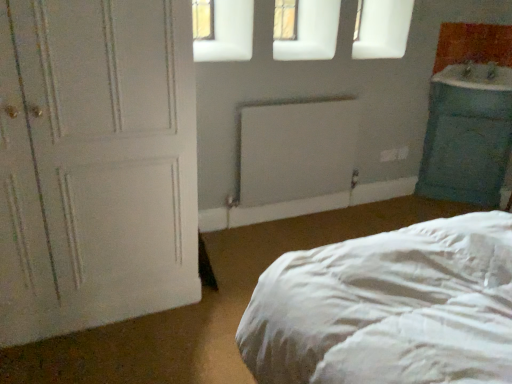
Identify the location of white matte radiator at center. This screenshot has width=512, height=384. (296, 150).

Describe the element at coordinates (466, 144) in the screenshot. This screenshot has height=384, width=512. I see `teal fabric pillow at right` at that location.

At what (x,y) coordinates should I click in order to perform the action: click on white matte radiator at center. Please return your answer as a coordinate pair (x, y). Looking at the image, I should click on (296, 150).

From the image's perspective, is teal fabric pillow at right positioned above or below white matte radiator at center?

teal fabric pillow at right is above white matte radiator at center.

Considering the sizes of objects teal fabric pillow at right and white matte radiator at center in the image provided, who is bigger, teal fabric pillow at right or white matte radiator at center?

teal fabric pillow at right is bigger.

From a real-world perspective, does teal fabric pillow at right stand above white matte radiator at center?

Yes, from a real-world perspective, teal fabric pillow at right is above white matte radiator at center.

Would you say white matte radiator at center is part of teal fabric pillow at right's contents?

Definitely not — white matte radiator at center is not inside teal fabric pillow at right.

Is white matte door at left thinner than teal fabric pillow at right?

No, white matte door at left is not thinner than teal fabric pillow at right.

In the image, is white matte door at left positioned in front of or behind teal fabric pillow at right?

Visually, white matte door at left is located in front of teal fabric pillow at right.

Which point is more forward, (68,217) or (484,189)?

The point (68,217) is closer.

Is teal fabric pillow at right at the back of white matte door at left?

No, white matte door at left is not facing away from teal fabric pillow at right.

From the image's perspective, is white matte radiator at center below white matte door at left?

No.

Is white matte radiator at center facing away from white matte door at left?

No, white matte door at left is not at the back of white matte radiator at center.

Is white matte radiator at center positioned far away from white matte door at left?

white matte radiator at center is positioned a significant distance from white matte door at left.

Can you confirm if white matte radiator at center is taller than white matte door at left?

No.

From the image's perspective, is teal fabric pillow at right positioned above or below white matte door at left?

teal fabric pillow at right is above white matte door at left.

Looking at this image, is teal fabric pillow at right oriented towards white matte door at left?

Yes, teal fabric pillow at right faces towards white matte door at left.

Is teal fabric pillow at right to the left or to the right of white matte door at left in the image?

In the image, teal fabric pillow at right appears on the right side of white matte door at left.

Is teal fabric pillow at right outside of white matte door at left?

That's correct, teal fabric pillow at right is outside of white matte door at left.

Between blue glossy sink at right and white matte radiator at center, which one appears on the left side from the viewer's perspective?

white matte radiator at center is more to the left.

Looking at this image, which object is closer to the camera, blue glossy sink at right or white matte radiator at center?

white matte radiator at center is more forward.

What's the angular difference between blue glossy sink at right and white matte radiator at center's facing directions?

They differ by 87.2 degrees in their facing directions.

Does blue glossy sink at right have a lesser height compared to white matte radiator at center?

Indeed, blue glossy sink at right has a lesser height compared to white matte radiator at center.

Considering the points (469, 67) and (425, 152), which point is in front, point (469, 67) or point (425, 152)?

The point (469, 67) is closer to the camera.

Is blue glossy sink at right in contact with teal fabric pillow at right?

No, blue glossy sink at right is not making contact with teal fabric pillow at right.

Looking at their sizes, would you say blue glossy sink at right is wider or thinner than teal fabric pillow at right?

blue glossy sink at right is wider than teal fabric pillow at right.

Relative to teal fabric pillow at right, is blue glossy sink at right in front or behind?

Clearly, blue glossy sink at right is in front of teal fabric pillow at right.

Which is in front, point (490, 62) or point (98, 103)?

The point (98, 103) is closer to the camera.

How distant is blue glossy sink at right from white matte door at left?

7.32 feet.

Would you say white matte door at left is part of blue glossy sink at right's contents?

No, white matte door at left is not inside blue glossy sink at right.

In the image, is blue glossy sink at right positioned in front of or behind white matte door at left?

Visually, blue glossy sink at right is located behind white matte door at left.

Image resolution: width=512 pixels, height=384 pixels. I want to click on cabinetry above the white matte radiator at center (from the image's perspective), so click(x=466, y=144).

Find the location of a particular element. The height and width of the screenshot is (384, 512). cabinetry that is under the white matte door at left (from a real-world perspective) is located at coordinates coord(466,144).

Looking at the image, which one is located closer to blue glossy sink at right, white matte door at left or white matte radiator at center?

The object closer to blue glossy sink at right is white matte radiator at center.

Considering their positions, is white matte radiator at center positioned closer to blue glossy sink at right than white matte door at left?

white matte radiator at center is closer to blue glossy sink at right.

Based on the photo, estimate the real-world distances between objects in this image. Which object is closer to teal fabric pillow at right, white matte radiator at center or blue glossy sink at right?

blue glossy sink at right lies closer to teal fabric pillow at right than the other object.

From the image, which object appears to be farther from white matte radiator at center, white matte door at left or blue glossy sink at right?

blue glossy sink at right is positioned further to the anchor white matte radiator at center.

Based on their spatial positions, is blue glossy sink at right or white matte radiator at center closer to white matte door at left?

white matte radiator at center.

Based on their spatial positions, is blue glossy sink at right or teal fabric pillow at right further from white matte radiator at center?

blue glossy sink at right is positioned further to the anchor white matte radiator at center.

Which object lies nearer to the anchor point white matte door at left, blue glossy sink at right or teal fabric pillow at right?

Based on the image, teal fabric pillow at right appears to be nearer to white matte door at left.

When comparing their distances from teal fabric pillow at right, does white matte door at left or white matte radiator at center seem further?

Among the two, white matte door at left is located further to teal fabric pillow at right.

I want to click on radiator between white matte door at left and teal fabric pillow at right in the horizontal direction, so click(296, 150).

Where is `cabinetry situated between white matte radiator at center and blue glossy sink at right from left to right`? Image resolution: width=512 pixels, height=384 pixels. cabinetry situated between white matte radiator at center and blue glossy sink at right from left to right is located at coordinates (466, 144).

This screenshot has height=384, width=512. In order to click on radiator between white matte door at left and blue glossy sink at right in the horizontal direction in this screenshot , I will do `click(296, 150)`.

This screenshot has width=512, height=384. In order to click on cabinetry between white matte door at left and blue glossy sink at right from left to right in this screenshot , I will do `click(466, 144)`.